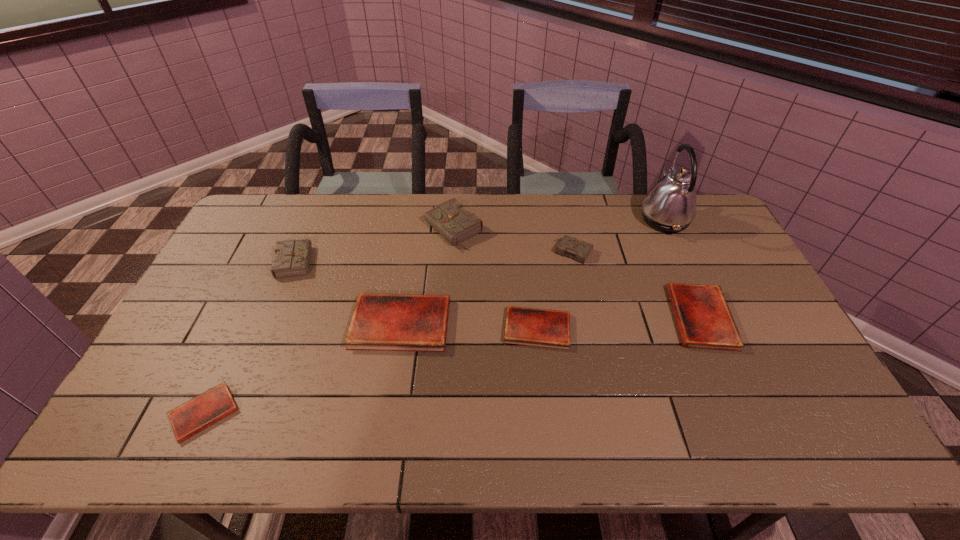
Where is `kettle`? The image size is (960, 540). kettle is located at coordinates (670, 206).

Locate an element on the screen. This screenshot has height=540, width=960. the second green diary from right to left is located at coordinates (450, 219).

The width and height of the screenshot is (960, 540). Find the location of `the biggest green diary`. the biggest green diary is located at coordinates click(x=450, y=219).

Find the location of a particular element. the leftmost green diary is located at coordinates coord(292,258).

Locate an element on the screen. This screenshot has width=960, height=540. the second smallest green diary is located at coordinates (292, 258).

You are a GUI agent. You are given a task and a screenshot of the screen. Output one action in this format:
    pyautogui.click(x=<x>, y=<y>)
    Task: Click on the rightmost green diary
    The width and height of the screenshot is (960, 540).
    Given the screenshot: What is the action you would take?
    pyautogui.click(x=579, y=250)

Image resolution: width=960 pixels, height=540 pixels. In order to click on the smallest green diary in this screenshot , I will do `click(579, 250)`.

You are a GUI agent. You are given a task and a screenshot of the screen. Output one action in this format:
    pyautogui.click(x=<x>, y=<y>)
    Task: Click on the biggest red diary
    This screenshot has width=960, height=540.
    Given the screenshot: What is the action you would take?
    385,322

You are a GUI agent. You are given a task and a screenshot of the screen. Output one action in this format:
    pyautogui.click(x=<x>, y=<y>)
    Task: Click on the fourth shortest object
    Image resolution: width=960 pixels, height=540 pixels.
    Given the screenshot: What is the action you would take?
    tap(385, 322)

You are a GUI agent. You are given a task and a screenshot of the screen. Output one action in this format:
    pyautogui.click(x=<x>, y=<y>)
    Task: Click on the sixth tallest object
    
    Given the screenshot: What is the action you would take?
    pyautogui.click(x=704, y=320)